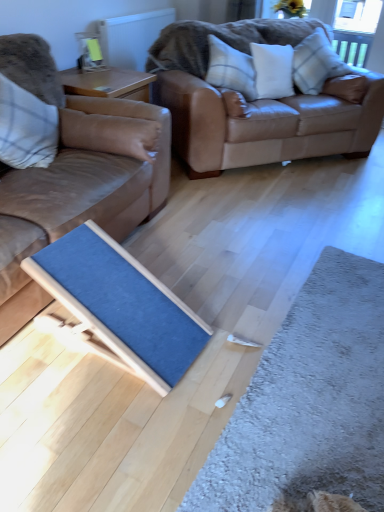
Locate an element on the screen. Image resolution: width=384 pixels, height=512 pixels. free location in front of blue fabric doormat at center, which is the first doormat from left to right is located at coordinates (108, 426).